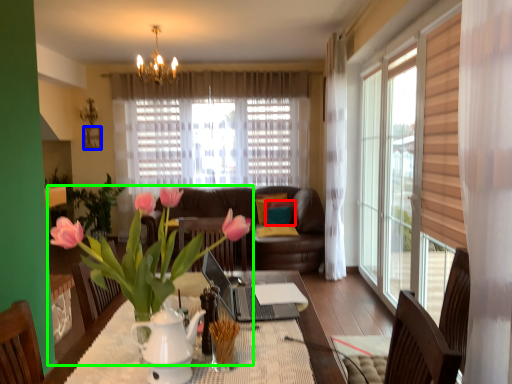
Question: Estimate the real-world distances between objects in this image. Which object is closer to pillow (highlighted by a red box), picture frame (highlighted by a blue box) or houseplant (highlighted by a green box)?

Choices:
 (A) picture frame
 (B) houseplant

Answer: (A)